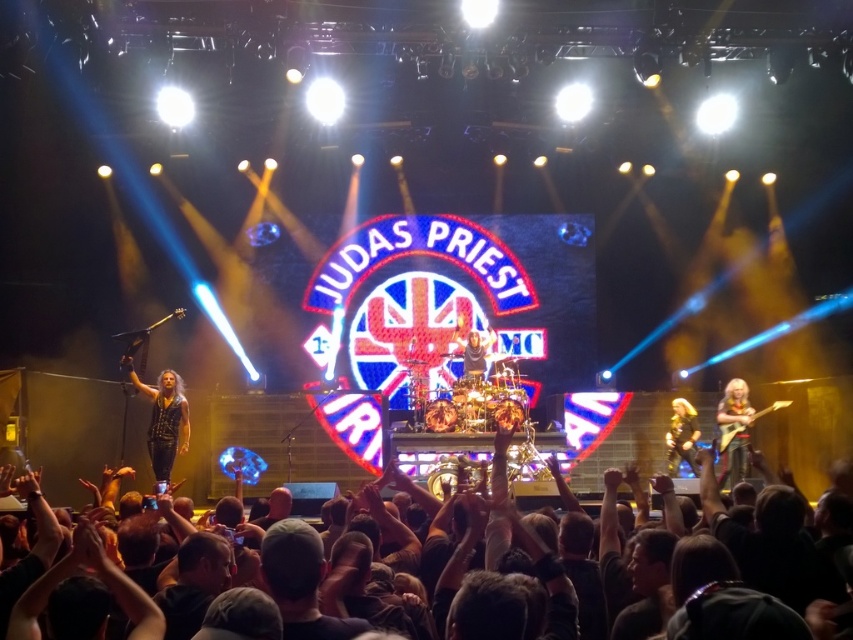
Question: Which of the following is the closest to the observer?

Choices:
 (A) shiny black leather jacket at right
 (B) shiny gold guitar at right
 (C) shiny gold drum set at center

Answer: (B)

Question: Can you confirm if leather jacket at center is wider than shiny gold guitar at right?

Choices:
 (A) yes
 (B) no

Answer: (A)

Question: Which object is the farthest from the dark hair at center?

Choices:
 (A) shiny gold guitar at right
 (B) leather jacket at center
 (C) shiny black leather jacket at right

Answer: (B)

Question: Does shiny gold guitar at right appear on the right side of shiny gold drum set at center?

Choices:
 (A) yes
 (B) no

Answer: (A)

Question: Is leather jacket at center below shiny black leather jacket at right?

Choices:
 (A) no
 (B) yes

Answer: (A)

Question: Considering the real-world distances, which object is closest to the leather jacket at center?

Choices:
 (A) shiny gold drum set at center
 (B) dark hair at center

Answer: (B)